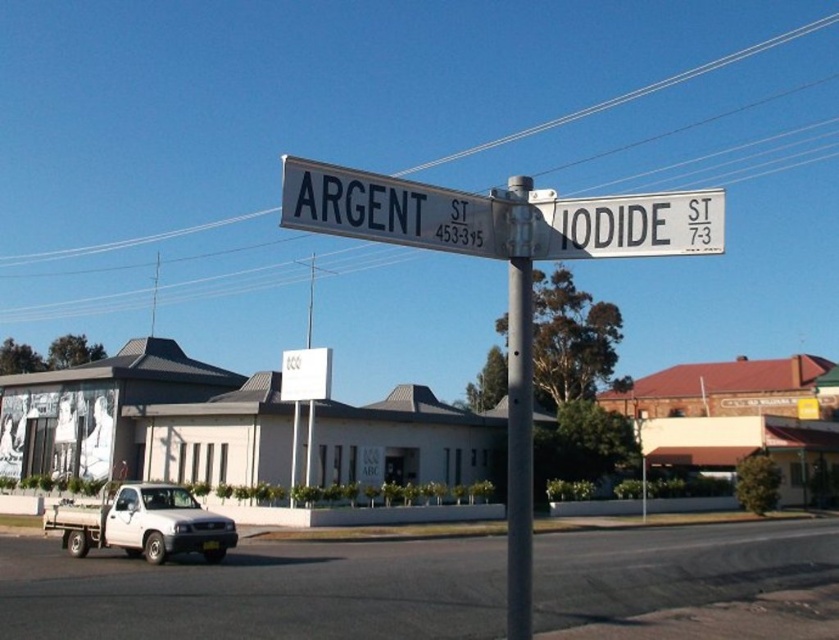
Is point (303, 426) in front of point (202, 552)?

No.

Does point (404, 444) come farther from viewer compared to point (137, 536)?

Yes.

Locate an element on the screen. The image size is (839, 640). white concrete building at center is located at coordinates (146, 419).

Is white metallic street sign at upper center positioned at the back of gray metallic pole at center?

No.

Find the location of `white metallic street sign at upper center`. white metallic street sign at upper center is located at coordinates (498, 216).

Is point (513, 202) closer to viewer compared to point (513, 372)?

No, (513, 202) is further to viewer.

This screenshot has height=640, width=839. Find the location of `white metallic street sign at upper center`. white metallic street sign at upper center is located at coordinates (498, 216).

Does gray metallic pole at center have a larger size compared to white matte truck at lower left?

Yes, gray metallic pole at center is bigger than white matte truck at lower left.

Is gray metallic pole at center to the right of white matte truck at lower left from the viewer's perspective?

Indeed, gray metallic pole at center is positioned on the right side of white matte truck at lower left.

This screenshot has width=839, height=640. I want to click on gray metallic pole at center, so click(x=519, y=413).